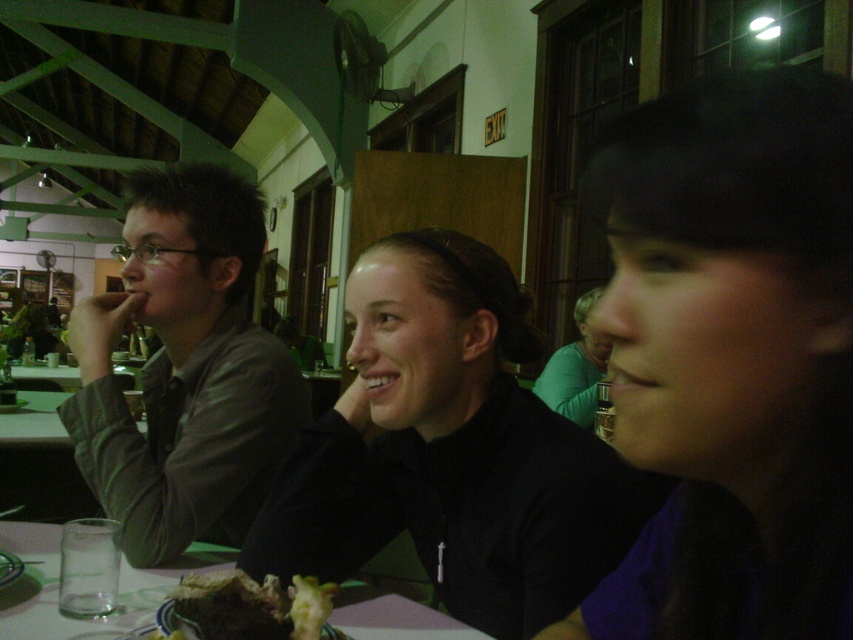
You are a waiter at this table and need to deliver a drink to the clear glass at lower left and a dessert to the chocolate cake at center. Which item should you reach for first to avoid obstructing the other?

You should reach for the clear glass at lower left first because it is closer to you, so you can serve the drink without blocking the path to the chocolate cake at center, which is further away.

You are a server at the restaurant and need to deliver a drink to the customer wearing the green matte shirt at center. The clear glass at lower left is in the way. Can you move the glass to the side without disturbing the other items on the table?

The clear glass at lower left is below the green matte shirt at center, so it is positioned under the shirt, making it impossible to move the glass without disturbing the shirt. However, since the shirt is on a person, you can ask the customer to adjust their position slightly to allow you to move the glass safely.

You are standing at the point marked by the coordinates point (39, 548). You want to walk to the exit sign in the background. Is there enough space between the three individuals seated at the table to pass through?

The three individuals seated at the table are 1.21 meters apart, so yes, there is enough space to pass through since the average person is about 0.5 meters wide, leaving sufficient room.